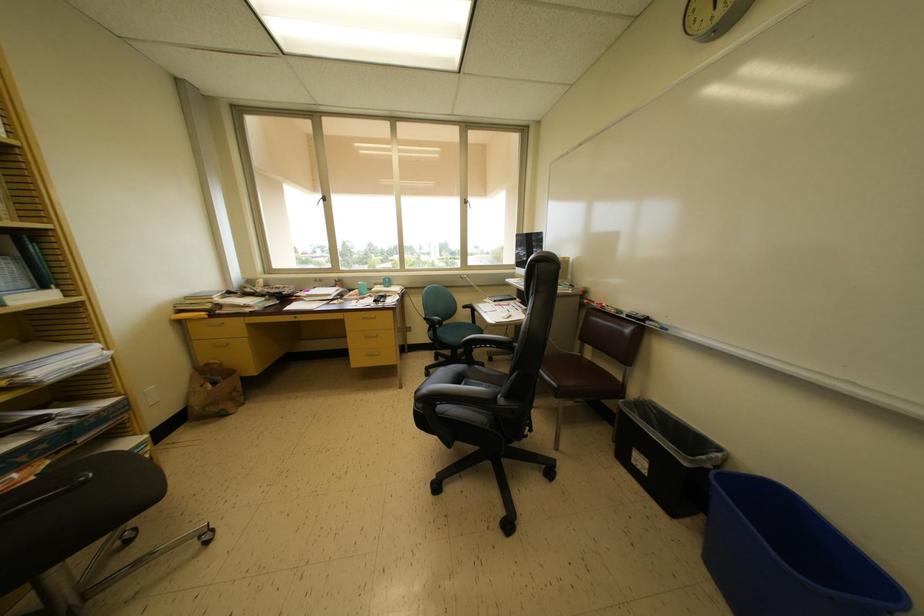
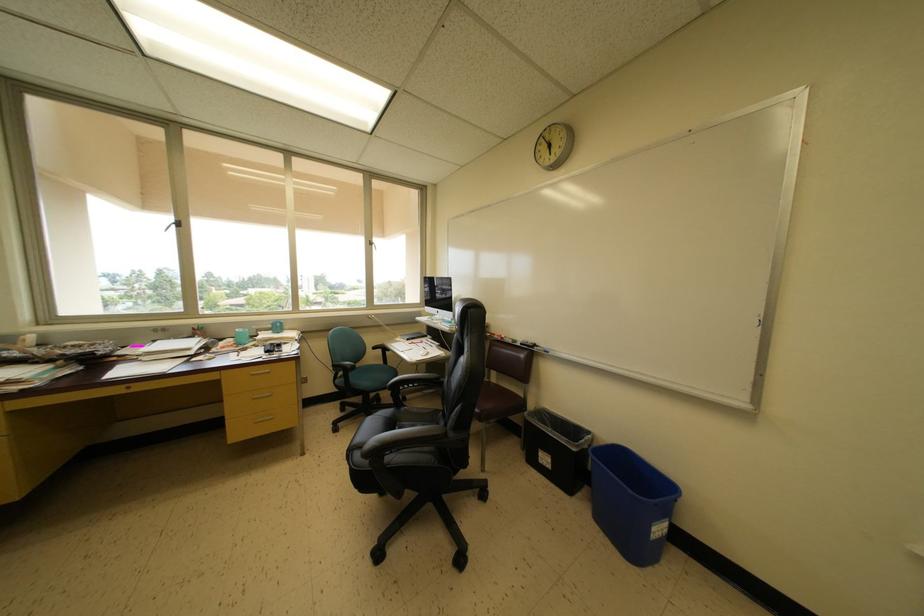
The point at (363, 288) is marked in the first image. Where is the corresponding point in the second image?

(240, 334)